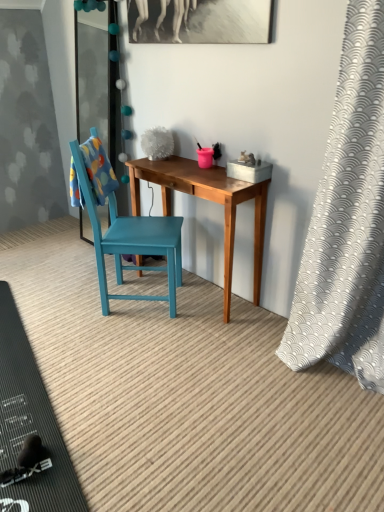
The width and height of the screenshot is (384, 512). Find the location of `free space to the left of white textured curtain at right`. free space to the left of white textured curtain at right is located at coordinates (254, 376).